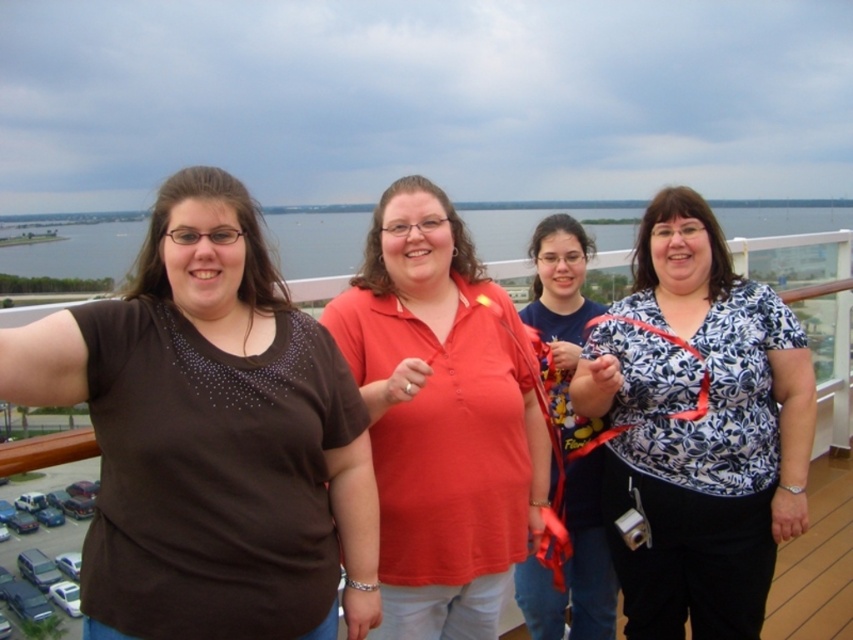
Question: Is white floral blouse at center further to camera compared to white floral blouse at right?

Choices:
 (A) no
 (B) yes

Answer: (A)

Question: Is matte brown shirt at left bigger than matte red polo shirt at center?

Choices:
 (A) yes
 (B) no

Answer: (A)

Question: Which object appears closest to the camera in this image?

Choices:
 (A) white floral blouse at center
 (B) matte brown shirt at left

Answer: (B)

Question: Which object appears closest to the camera in this image?

Choices:
 (A) white floral blouse at right
 (B) matte red polo shirt at center
 (C) matte brown shirt at left
 (D) white floral blouse at center

Answer: (C)

Question: Can you confirm if matte brown shirt at left is positioned above white floral blouse at center?

Choices:
 (A) yes
 (B) no

Answer: (A)

Question: Which point appears closest to the camera in this image?

Choices:
 (A) (155, 625)
 (B) (553, 598)

Answer: (A)